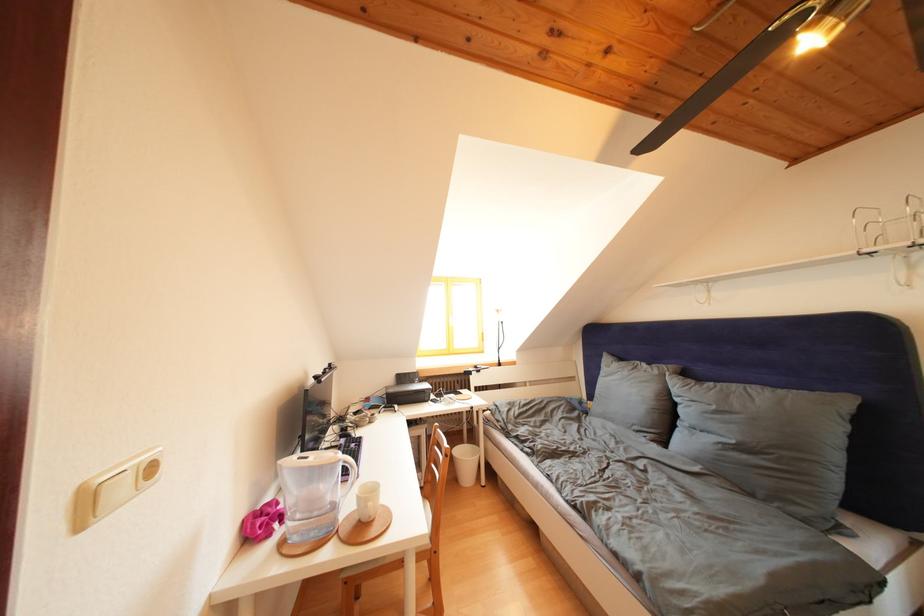
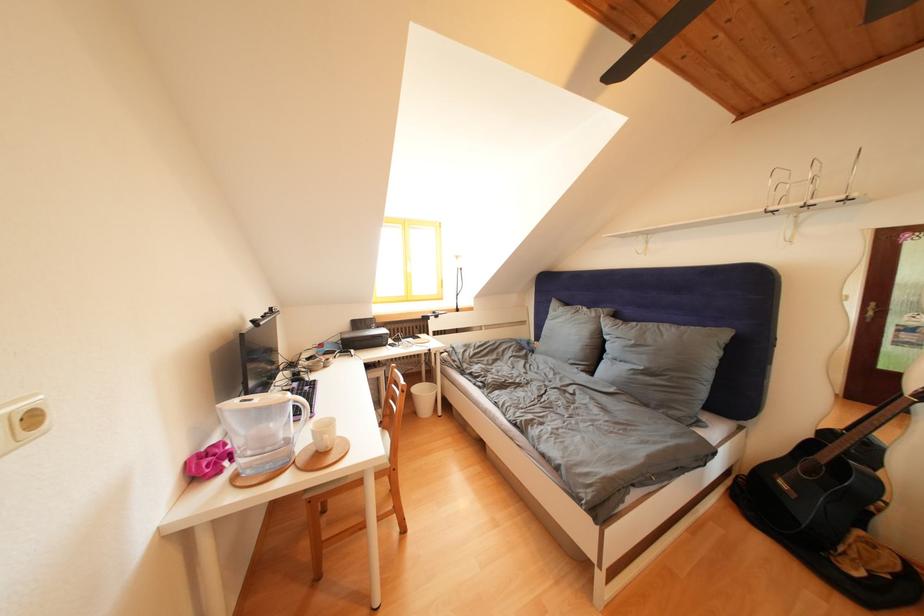
The point at (x=362, y=513) is marked in the first image. Where is the corresponding point in the second image?

(320, 446)